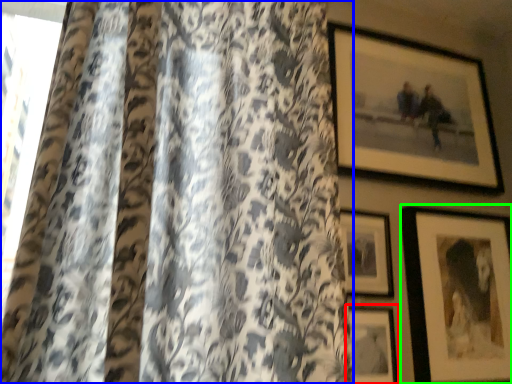
Question: Considering the real-world distances, which object is farthest from picture frame (highlighted by a red box)? curtain (highlighted by a blue box) or picture frame (highlighted by a green box)?

Choices:
 (A) curtain
 (B) picture frame

Answer: (A)